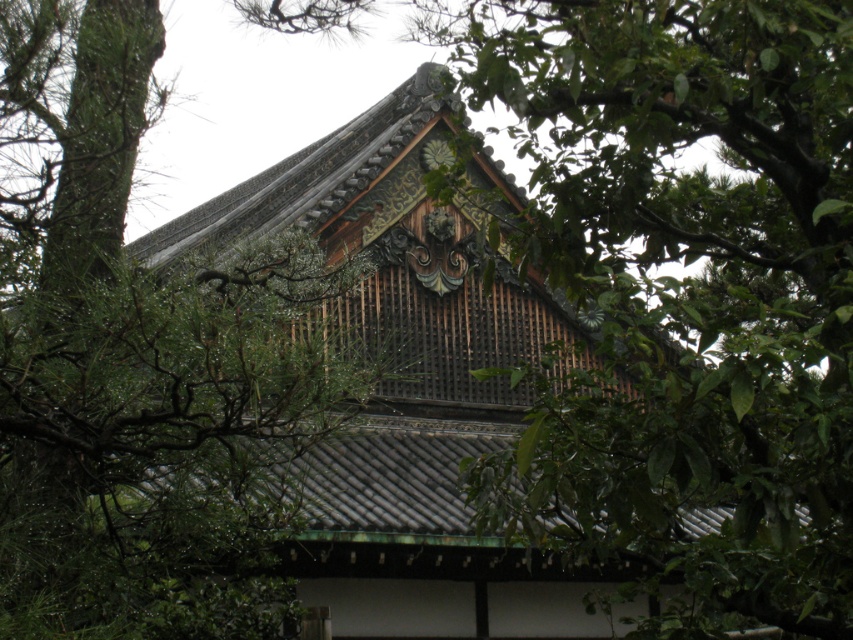
You are a visitor standing in front of the traditional Japanese building. You notice the green leafy tree at upper left and the shiny dark brown wooden roof at center. Which object is positioned lower in the scene?

The green leafy tree at upper left is located below the shiny dark brown wooden roof at center, so the tree is positioned lower in the scene.

You are standing in front of the traditional Japanese building and want to take a photo of the green leafy tree at center. Where should you position yourself to capture it in the frame?

To capture the green leafy tree at center in the frame, position yourself at point (683, 292).